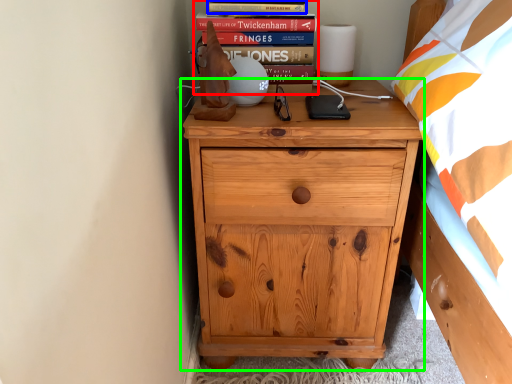
Question: Which is nearer to the book (highlighted by a red box)? paperback book (highlighted by a blue box) or chest of drawers (highlighted by a green box).

Choices:
 (A) paperback book
 (B) chest of drawers

Answer: (A)